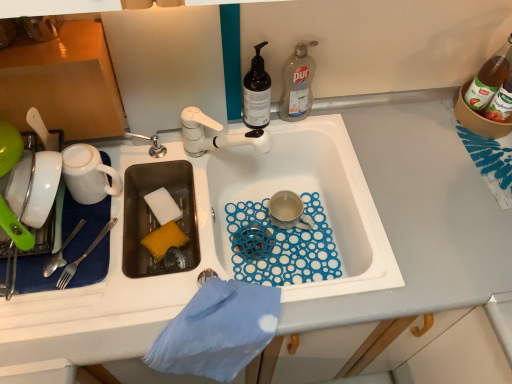
Image resolution: width=512 pixels, height=384 pixels. Find the location of `vacant space to the left of translucent glass bottle at upper right, the first bottle in the right-to-left sequence`. vacant space to the left of translucent glass bottle at upper right, the first bottle in the right-to-left sequence is located at coordinates (416, 122).